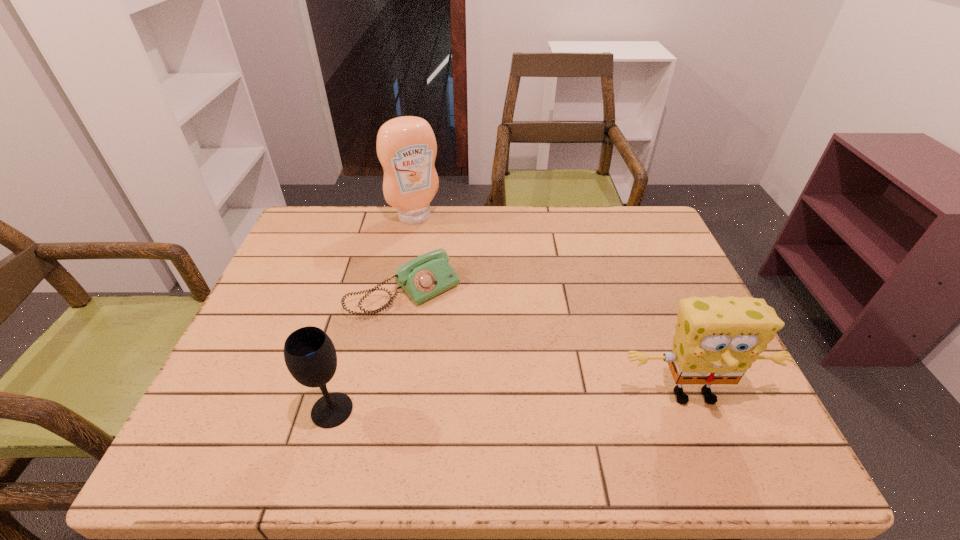
Identify the location of free space located on the label of the farthest object. (466, 288).

Where is `vacant space located on the label of the farthest object`? Image resolution: width=960 pixels, height=540 pixels. vacant space located on the label of the farthest object is located at coordinates tap(450, 264).

This screenshot has width=960, height=540. I want to click on vacant area located 0.080m on the label of the farthest object, so click(434, 241).

You are a GUI agent. You are given a task and a screenshot of the screen. Output one action in this format:
    pyautogui.click(x=<x>, y=<y>)
    Task: Click on the object situated at the far edge
    The height and width of the screenshot is (540, 960).
    Given the screenshot: What is the action you would take?
    pyautogui.click(x=406, y=146)

This screenshot has height=540, width=960. In order to click on wineglass situated at the near edge in this screenshot , I will do `click(310, 356)`.

Where is `sponge present at the near edge`? The height and width of the screenshot is (540, 960). sponge present at the near edge is located at coordinates (716, 340).

You are a GUI agent. You are given a task and a screenshot of the screen. Output one action in this format:
    pyautogui.click(x=<x>, y=<y>)
    Task: Click on the object that is at the right edge
    
    Given the screenshot: What is the action you would take?
    pyautogui.click(x=716, y=340)

Identify the location of object situated at the near right corner. (716, 340).

I want to click on vacant space at the far edge of the desktop, so click(448, 207).

What are the coordinates of `vacant space at the left edge` in the screenshot? It's located at (316, 260).